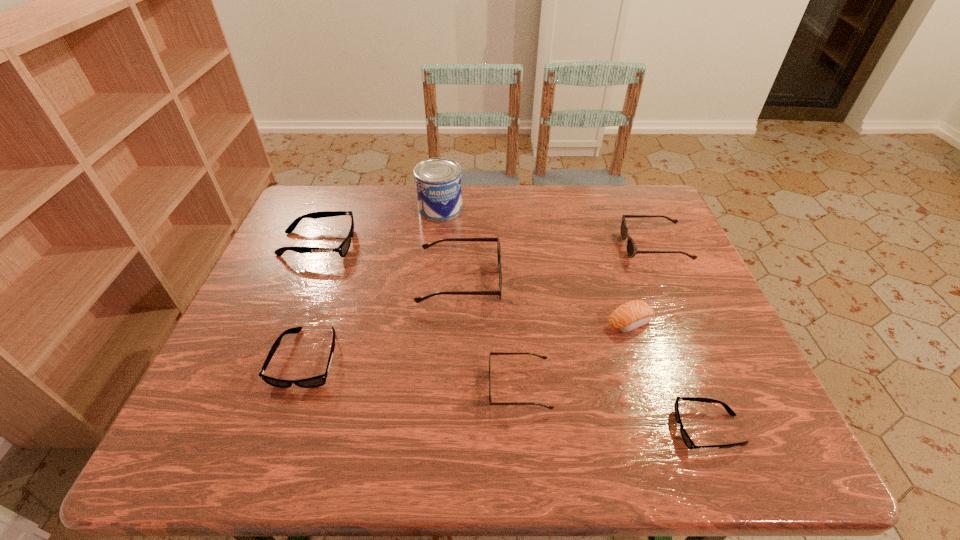
This screenshot has height=540, width=960. Identify the location of object that is at the near right corner. (689, 443).

Where is `vacant space at the far edge of the desktop`? The width and height of the screenshot is (960, 540). vacant space at the far edge of the desktop is located at coordinates (568, 221).

Image resolution: width=960 pixels, height=540 pixels. In the image, there is a desktop. What are the coordinates of `vacant space at the near edge` in the screenshot? It's located at (277, 460).

The image size is (960, 540). Identify the location of vacant space at the left edge of the desktop. (201, 407).

Identify the location of vacant space at the right edge of the desktop. This screenshot has height=540, width=960. (678, 265).

Identify the location of vacant space at the far left corner of the desktop. (330, 211).

Find the location of a particular element. free location at the near right corner of the desktop is located at coordinates (764, 445).

You are a GUI agent. You are given a task and a screenshot of the screen. Output one action in this format:
    pyautogui.click(x=<x>, y=<y>)
    Task: Click on the vacant area that lies between the orange sushi and the second farthest black sunglasses
    This screenshot has height=540, width=960.
    Given the screenshot: What is the action you would take?
    pyautogui.click(x=468, y=340)

What are the coordinates of `vacant space in between the shortest object and the biggest black sunglasses` in the screenshot? It's located at point(513,336).

The height and width of the screenshot is (540, 960). Find the location of `free spot between the second farthest black sunglasses and the biggest black sunglasses`. free spot between the second farthest black sunglasses and the biggest black sunglasses is located at coordinates (313, 301).